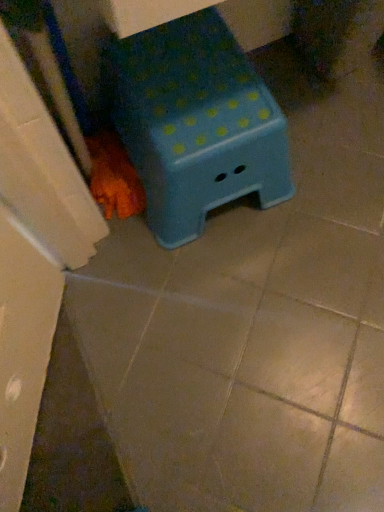
What is the approximate width of blue plastic stool at center?

blue plastic stool at center is 38.61 centimeters in width.

Identify the location of blue plastic stool at center. The height and width of the screenshot is (512, 384). (195, 123).

This screenshot has height=512, width=384. Describe the element at coordinates (195, 123) in the screenshot. I see `blue plastic stool at center` at that location.

The image size is (384, 512). What are the coordinates of `blue plastic stool at center` in the screenshot? It's located at (195, 123).